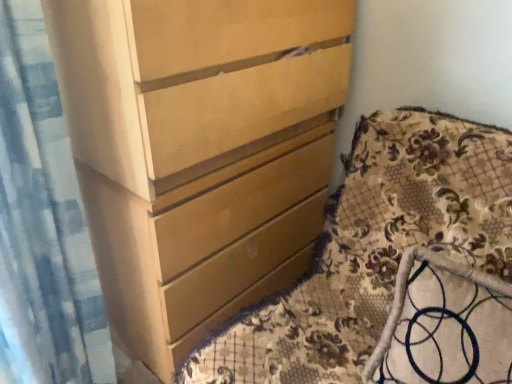
Question: Relative to floral fabric cushion at lower right, is matte wood chest of drawers at center in front or behind?

Choices:
 (A) front
 (B) behind

Answer: (B)

Question: Looking at their shapes, would you say matte wood chest of drawers at center is wider or thinner than floral fabric cushion at lower right?

Choices:
 (A) thin
 (B) wide

Answer: (B)

Question: Which object is the farthest from the floral fabric cushion at lower right?

Choices:
 (A) matte wood chest of drawers at center
 (B) blue textured fabric at left

Answer: (B)

Question: Estimate the real-world distances between objects in this image. Which object is closer to the blue textured fabric at left?

Choices:
 (A) matte wood chest of drawers at center
 (B) floral fabric cushion at lower right

Answer: (A)